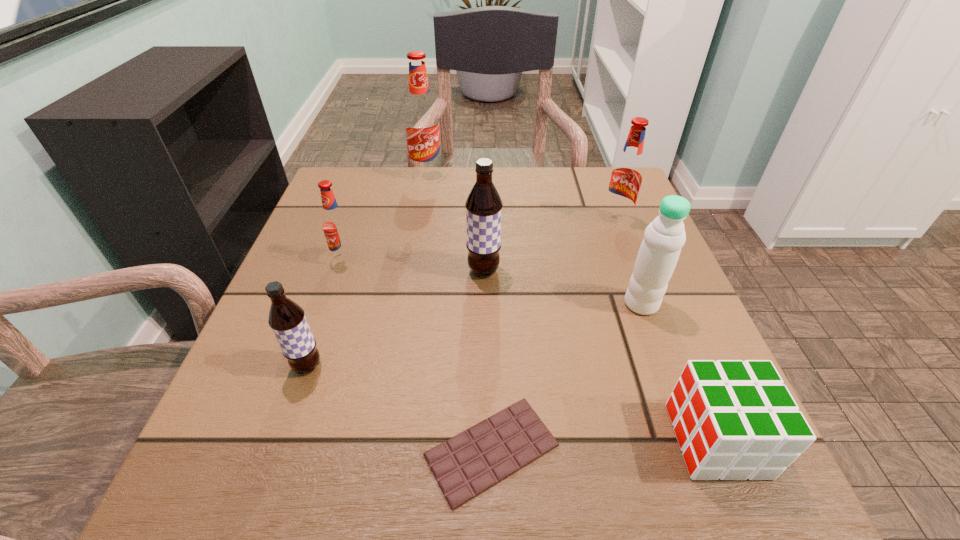
In order to click on free space located on the front of the nearest red root beer in this screenshot , I will do [x=284, y=436].

Find the location of a particular element. Image resolution: width=960 pixels, height=540 pixels. free space located on the right of the smaller brown root beer is located at coordinates (403, 366).

I want to click on free spot located 0.180m on the red face of the seventh tallest object, so click(x=548, y=440).

I want to click on free space located 0.330m on the red face of the seventh tallest object, so click(x=442, y=440).

Image resolution: width=960 pixels, height=540 pixels. In order to click on free space located on the red face of the seventh tallest object in this screenshot , I will do `click(619, 440)`.

Locate an element on the screen. Image resolution: width=960 pixels, height=540 pixels. vacant space positioned 0.140m on the right of the shortest object is located at coordinates (660, 450).

What are the coordinates of `cube at the near edge` in the screenshot? It's located at (733, 420).

Where is `chocolate bar situated at the near edge`? This screenshot has width=960, height=540. chocolate bar situated at the near edge is located at coordinates click(x=469, y=463).

Identify the location of root beer situated at the right edge. The width and height of the screenshot is (960, 540). (626, 176).

You are a GUI agent. You are given a task and a screenshot of the screen. Output one action in this format:
    pyautogui.click(x=<x>, y=<y>)
    Task: Click on the water bottle that is at the right edge
    
    Given the screenshot: What is the action you would take?
    pyautogui.click(x=664, y=237)